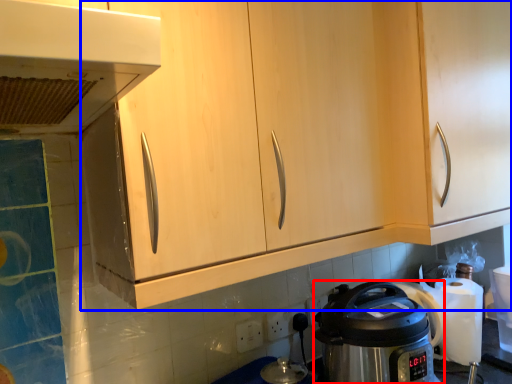
Question: Which of the following is the closest to the observer, kitchen appliance (highlighted by a red box) or cabinetry (highlighted by a blue box)?

Choices:
 (A) kitchen appliance
 (B) cabinetry

Answer: (B)